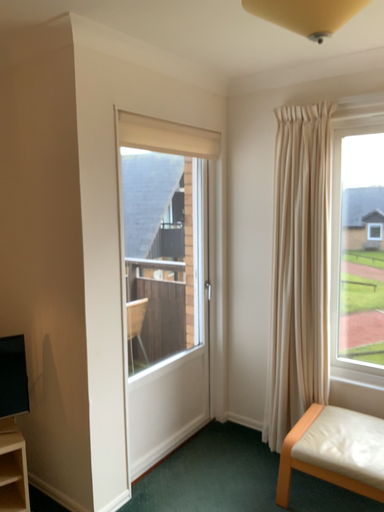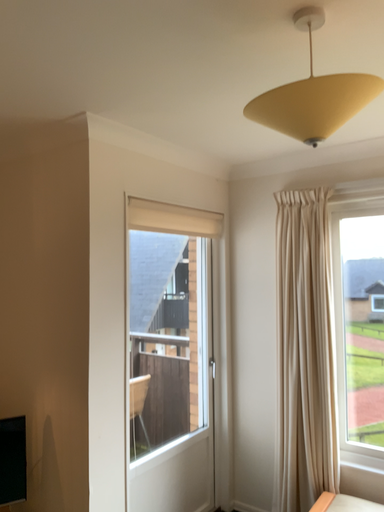
Question: How did the camera likely rotate when shooting the video?

Choices:
 (A) rotated upward
 (B) rotated downward

Answer: (A)